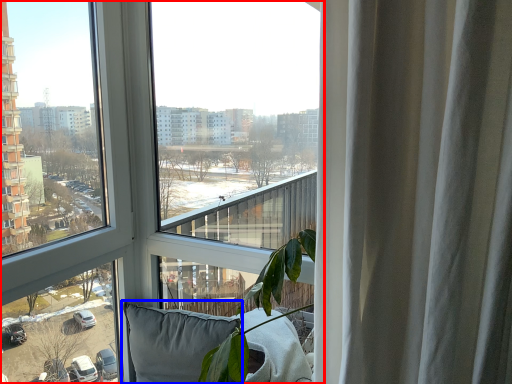
Question: Which object appears closest to the camera in this image, window (highlighted by a red box) or pillow (highlighted by a blue box)?

Choices:
 (A) window
 (B) pillow

Answer: (A)